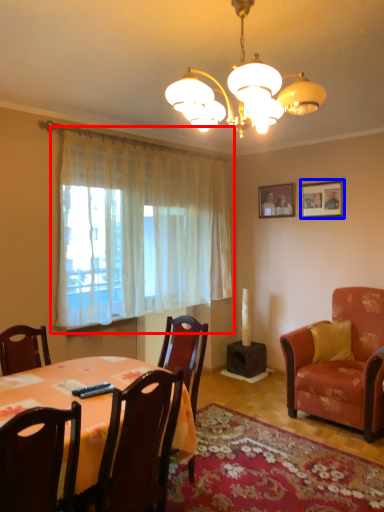
Question: Which point is closer to the camera, curtain (highlighted by a red box) or picture frame (highlighted by a blue box)?

Choices:
 (A) curtain
 (B) picture frame

Answer: (A)